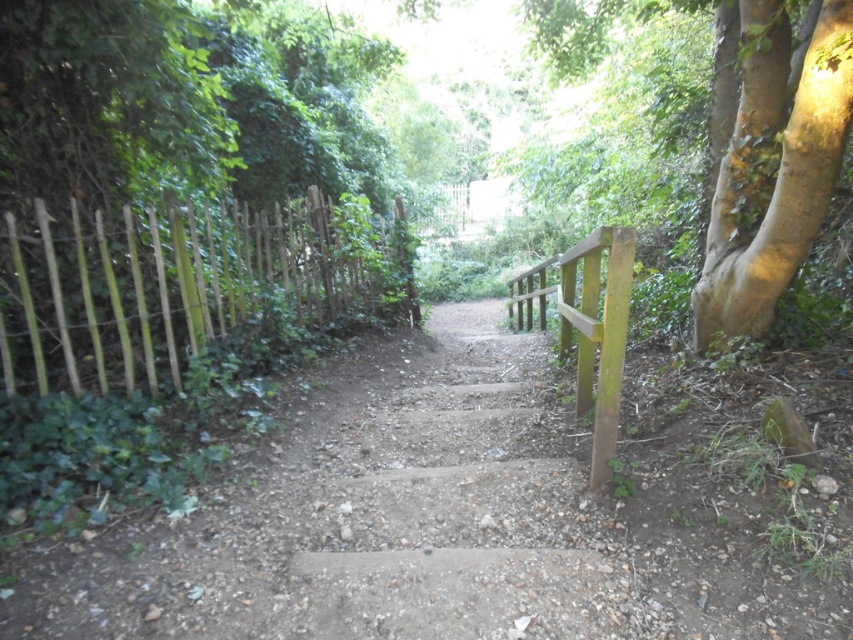
You are a hiker who wants to know if the wooden picket fence at left is wider than the green rough bark tree at right. Based on the scene, can you confirm this?

The wooden picket fence at left is wider than the green rough bark tree at right according to the description provided.

Consider the image. You are a hiker planning to walk along the path between the wooden picket fence at left and the green wood rail at right. Which structure is larger in size?

The wooden picket fence at left is bigger than the green wood rail at right, so the wooden picket fence at left is larger in size.